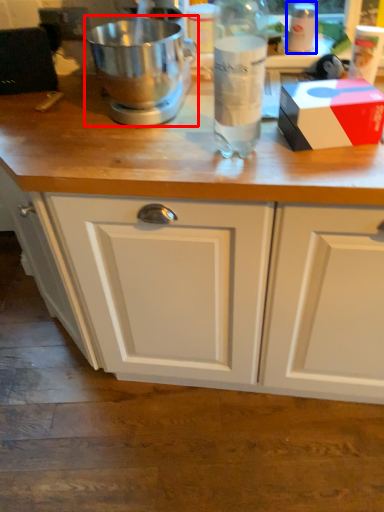
Question: Among these objects, which one is nearest to the camera, mixer (highlighted by a red box) or bottle (highlighted by a blue box)?

Choices:
 (A) mixer
 (B) bottle

Answer: (A)